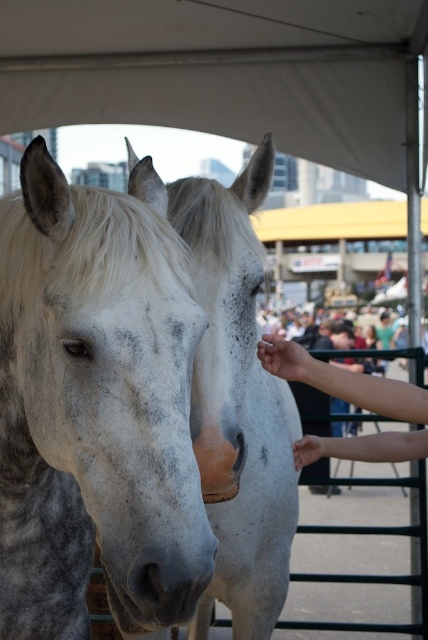
You are a photographer trying to capture the white speckled horse at center under the white fabric canopy at upper center. Can you confirm if the canopy is providing shade to the horse?

The white fabric canopy at upper center is positioned over the white speckled horse at center, so yes, it is likely providing shade to the horse.

You are a photographer at the event and want to capture both the white fabric canopy at upper center and the smooth skin hand at center in a single frame. Given their sizes, which object will occupy more space in your photo?

The white fabric canopy at upper center is bigger than the smooth skin hand at center, so it will occupy more space in the photo.

You are a photographer trying to capture both the speckled white horse at center and the white fabric canopy at upper center in a single frame. Given their sizes, which object should you focus on first to ensure both are clearly visible in your photo?

The speckled white horse at center has a smaller size compared to the white fabric canopy at upper center. To ensure both are clearly visible, focus on the speckled white horse at center first since it is smaller and requires more attention to detail.